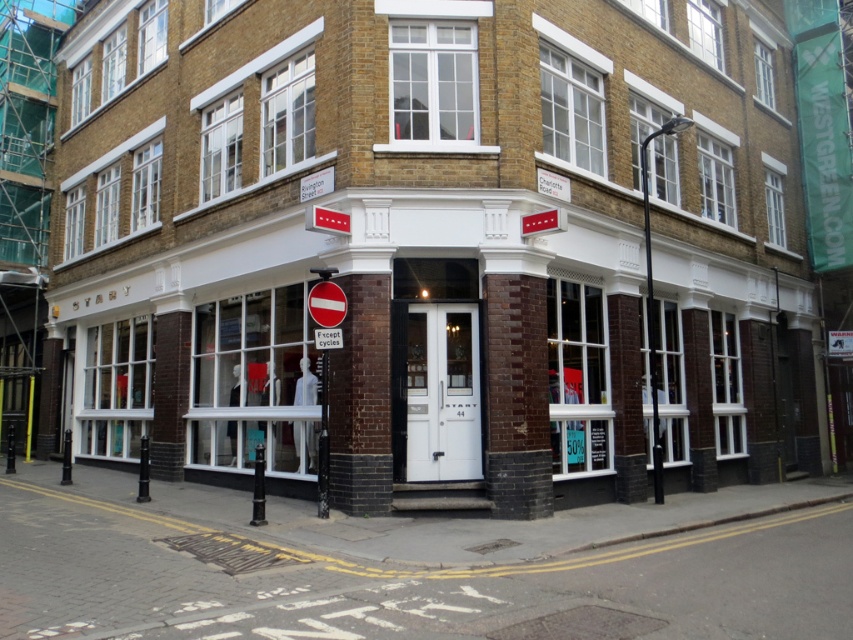
Can you confirm if black metal pole at upper right is positioned to the left of metallic pole at center?

In fact, black metal pole at upper right is to the right of metallic pole at center.

Measure the distance between point (x=653, y=372) and camera.

The distance of point (x=653, y=372) from camera is 13.66 meters.

Does point (669, 124) lie behind point (323, 353)?

Yes, point (669, 124) is farther from viewer.

You are a GUI agent. You are given a task and a screenshot of the screen. Output one action in this format:
    pyautogui.click(x=<x>, y=<y>)
    Task: Click on the black metal pole at upper right
    This screenshot has height=640, width=853.
    Given the screenshot: What is the action you would take?
    pyautogui.click(x=653, y=298)